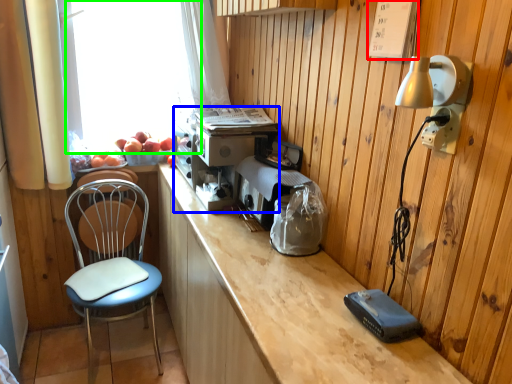
Question: Considering the real-world distances, which object is farthest from panel (highlighted by a red box)? coffee machine (highlighted by a blue box) or window screen (highlighted by a green box)?

Choices:
 (A) coffee machine
 (B) window screen

Answer: (B)